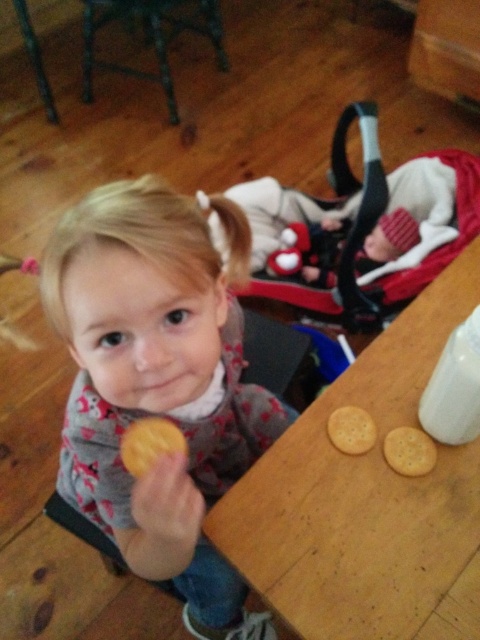
Question: Among these objects, which one is farthest from the camera?

Choices:
 (A) wooden table at center
 (B) white matte bottle at upper right
 (C) golden cracker at lower right
 (D) soft plush baby at center

Answer: (D)

Question: Is white matte bottle at upper right wider than golden crumbly cookie at lower right?

Choices:
 (A) no
 (B) yes

Answer: (B)

Question: Which of the following is the closest to the observer?

Choices:
 (A) soft plush baby at center
 (B) yellow matte cookie at center
 (C) golden cracker at lower right

Answer: (B)

Question: Can you confirm if wooden table at center is positioned below golden cracker at lower right?

Choices:
 (A) no
 (B) yes

Answer: (A)

Question: Which point is farther from the camera taking this photo?

Choices:
 (A) (477, 381)
 (B) (386, 189)
 (C) (365, 435)

Answer: (B)

Question: Can you confirm if matte pink shirt at center is wider than white matte bottle at upper right?

Choices:
 (A) yes
 (B) no

Answer: (A)